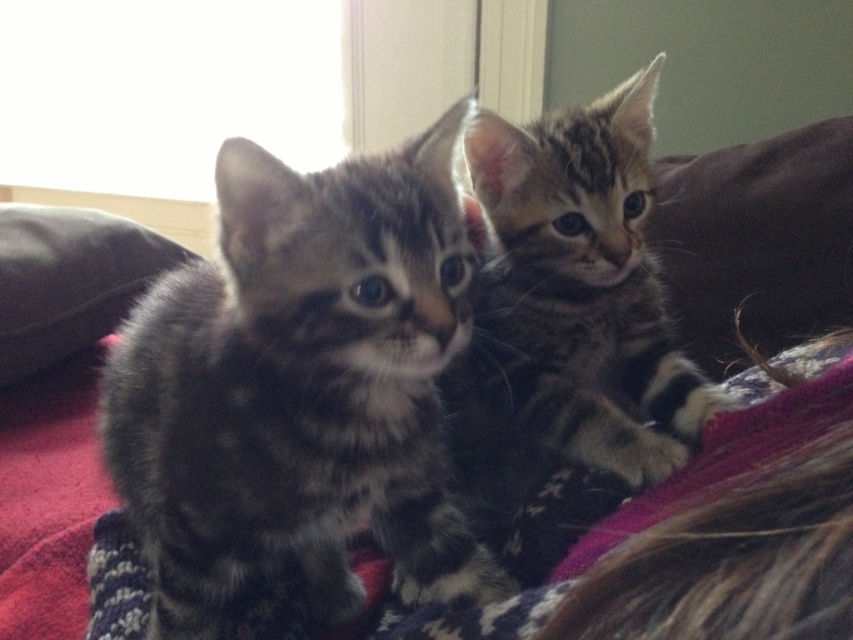
Question: Which of these objects is positioned farthest from the brown suede pillow at right?

Choices:
 (A) gray tabby kitten at center
 (B) knitted wool blanket at center
 (C) tabby fur kitten at center
 (D) black leather pillow at left

Answer: (D)

Question: Which point is closer to the camera taking this photo?

Choices:
 (A) (178, 538)
 (B) (776, 285)
 (C) (88, 221)
 (D) (582, 340)

Answer: (A)

Question: Which point appears closest to the camera in this image?

Choices:
 (A) (131, 289)
 (B) (759, 147)
 (C) (426, 385)
 (D) (276, 636)

Answer: (C)

Question: In this image, where is brown suede pillow at right located relative to knitted wool blanket at center?

Choices:
 (A) below
 (B) above

Answer: (B)

Question: Does knitted wool blanket at center appear on the right side of black leather pillow at left?

Choices:
 (A) no
 (B) yes

Answer: (B)

Question: Does gray tabby kitten at center have a smaller size compared to tabby fur kitten at center?

Choices:
 (A) no
 (B) yes

Answer: (B)